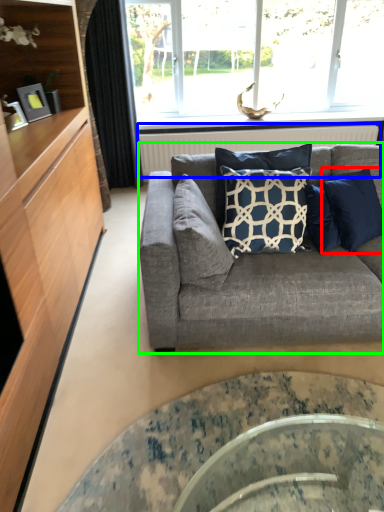
Question: Estimate the real-world distances between objects in this image. Which object is closer to pillow (highlighted by a red box), radiator (highlighted by a blue box) or studio couch (highlighted by a green box)?

Choices:
 (A) radiator
 (B) studio couch

Answer: (B)